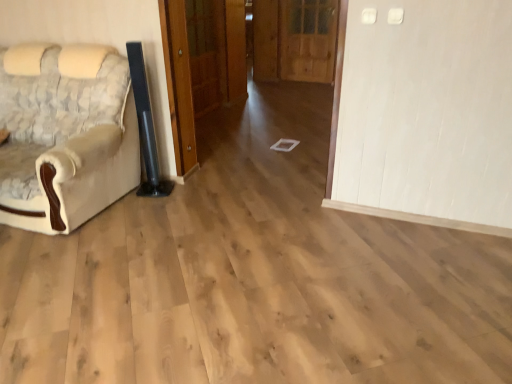
Question: Is wooden door at center, the first door in the right-to-left sequence, aimed at wooden door at center, placed as the 1th door when sorted from left to right?

Choices:
 (A) yes
 (B) no

Answer: (A)

Question: Are wooden door at center, which is the third door in left-to-right order, and wooden door at center, which is the 3th door from right to left, located far from each other?

Choices:
 (A) no
 (B) yes

Answer: (B)

Question: From a real-world perspective, is wooden door at center, which is the third door in left-to-right order, physically above wooden door at center, which is the 3th door from right to left?

Choices:
 (A) yes
 (B) no

Answer: (B)

Question: Is wooden door at center, the first door in the right-to-left sequence, touching wooden door at center, which is the 3th door from right to left?

Choices:
 (A) no
 (B) yes

Answer: (A)

Question: Can you confirm if wooden door at center, the first door in the right-to-left sequence, is smaller than wooden door at center, which is the 3th door from right to left?

Choices:
 (A) yes
 (B) no

Answer: (B)

Question: In terms of size, does wooden door at center, the first door in the right-to-left sequence, appear bigger or smaller than wooden door at center, the second door from the right?

Choices:
 (A) small
 (B) big

Answer: (A)

Question: Would you say wooden door at center, which is the third door in left-to-right order, is inside or outside wooden door at center, which is counted as the second door, starting from the left?

Choices:
 (A) outside
 (B) inside

Answer: (A)

Question: Is point (309, 51) positioned closer to the camera than point (229, 3)?

Choices:
 (A) farther
 (B) closer

Answer: (A)

Question: From a real-world perspective, is wooden door at center, which is the third door in left-to-right order, physically located above or below wooden door at center, which is counted as the second door, starting from the left?

Choices:
 (A) above
 (B) below

Answer: (B)

Question: Considering the positions of wooden door at center, which is the third door in left-to-right order, and wooden door at center, placed as the 1th door when sorted from left to right, in the image, is wooden door at center, which is the third door in left-to-right order, taller or shorter than wooden door at center, placed as the 1th door when sorted from left to right,?

Choices:
 (A) short
 (B) tall

Answer: (A)

Question: In the image, is wooden door at center, which is the third door in left-to-right order, positioned in front of or behind wooden door at center, placed as the 1th door when sorted from left to right?

Choices:
 (A) front
 (B) behind

Answer: (B)

Question: Is wooden door at center, which is the third door in left-to-right order, wider or thinner than wooden door at center, placed as the 1th door when sorted from left to right?

Choices:
 (A) thin
 (B) wide

Answer: (B)

Question: Do you think wooden door at center, which is the third door in left-to-right order, is within wooden door at center, placed as the 1th door when sorted from left to right, or outside of it?

Choices:
 (A) outside
 (B) inside

Answer: (A)

Question: From the image's perspective, is wooden door at center, which is the 3th door from right to left, located above or below wooden door at center, the second door from the right?

Choices:
 (A) below
 (B) above

Answer: (B)

Question: Considering the positions of wooden door at center, which is the 3th door from right to left, and wooden door at center, the second door from the right, in the image, is wooden door at center, which is the 3th door from right to left, bigger or smaller than wooden door at center, the second door from the right,?

Choices:
 (A) small
 (B) big

Answer: (A)